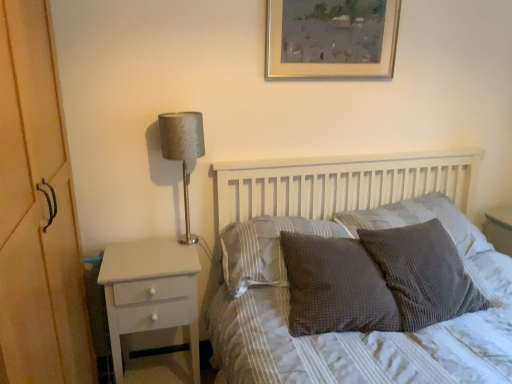
Locate an element on the screen. gold/golden frame at upper center is located at coordinates (331, 38).

At what (x,y) coordinates should I click in order to perform the action: click on textured gray pillow at center, marked as the 2th pillow in a left-to-right arrangement. Please return your answer as a coordinate pair (x, y). This screenshot has width=512, height=384. Looking at the image, I should click on (335, 287).

Measure the distance between satin silver lamp at left and camera.

5.82 feet.

The height and width of the screenshot is (384, 512). Find the location of `textured gray pillow at center, which is counted as the fourth pillow, starting from the left`. textured gray pillow at center, which is counted as the fourth pillow, starting from the left is located at coordinates (419, 221).

Describe the element at coordinates (150, 292) in the screenshot. I see `white painted wood nightstand at left` at that location.

This screenshot has width=512, height=384. In order to click on textured gray pillow at center, which is the 4th pillow in right-to-left order in this screenshot , I will do `click(264, 249)`.

Considering the positions of point (348, 284) and point (280, 2), is point (348, 284) closer or farther from the camera than point (280, 2)?

Point (348, 284) is closer to the camera than point (280, 2).

How different are the orientations of textured gray pillow at center, marked as the 2th pillow in a left-to-right arrangement, and gold/golden frame at upper center in degrees?

The angular difference between textured gray pillow at center, marked as the 2th pillow in a left-to-right arrangement, and gold/golden frame at upper center is 8.53 degrees.

In terms of height, does textured gray pillow at center, marked as the 2th pillow in a left-to-right arrangement, look taller or shorter compared to gold/golden frame at upper center?

Clearly, textured gray pillow at center, marked as the 2th pillow in a left-to-right arrangement, is shorter compared to gold/golden frame at upper center.

Image resolution: width=512 pixels, height=384 pixels. Find the location of `picture frame that is above the textured gray pillow at center, the 3th pillow viewed from the right (from the image's perspective)`. picture frame that is above the textured gray pillow at center, the 3th pillow viewed from the right (from the image's perspective) is located at coordinates (331, 38).

Which object is further away from the camera taking this photo, textured gray pillow at center, which is the 4th pillow in right-to-left order, or textured gray pillow at center, the first pillow positioned from the right?

Positioned behind is textured gray pillow at center, the first pillow positioned from the right.

Does textured gray pillow at center, which is counted as the 1th pillow, starting from the left, have a larger size compared to textured gray pillow at center, the first pillow positioned from the right?

No.

Is textured gray pillow at center, which is counted as the 1th pillow, starting from the left, facing away from textured gray pillow at center, which is counted as the fourth pillow, starting from the left?

No, textured gray pillow at center, which is counted as the 1th pillow, starting from the left, is not facing away from textured gray pillow at center, which is counted as the fourth pillow, starting from the left.

From a real-world perspective, who is located lower, textured gray pillow at center, which is the 4th pillow in right-to-left order, or textured gray pillow at center, the first pillow positioned from the right?

textured gray pillow at center, which is the 4th pillow in right-to-left order, is physically lower.

Which object is more forward, white painted wood nightstand at left or gold/golden frame at upper center?

white painted wood nightstand at left is in front.

Identify the location of nightstand below the gold/golden frame at upper center (from the image's perspective). The width and height of the screenshot is (512, 384). (150, 292).

How distant is white painted wood nightstand at left from gold/golden frame at upper center?

The distance of white painted wood nightstand at left from gold/golden frame at upper center is 1.15 meters.

Does white painted wood nightstand at left have a smaller size compared to gold/golden frame at upper center?

No, white painted wood nightstand at left is not smaller than gold/golden frame at upper center.

From the image's perspective, does white painted wood nightstand at left appear lower than satin silver lamp at left?

Indeed, from the image's perspective, white painted wood nightstand at left is shown beneath satin silver lamp at left.

Is white painted wood nightstand at left smaller than satin silver lamp at left?

No, white painted wood nightstand at left is not smaller than satin silver lamp at left.

How far apart are white painted wood nightstand at left and satin silver lamp at left?

white painted wood nightstand at left and satin silver lamp at left are 14.99 inches apart from each other.

Is white painted wood nightstand at left at the right side of satin silver lamp at left?

In fact, white painted wood nightstand at left is to the left of satin silver lamp at left.

Which is correct: textured gray pillow at center, which is counted as the 1th pillow, starting from the left, is inside satin silver lamp at left, or outside of it?

textured gray pillow at center, which is counted as the 1th pillow, starting from the left, is not enclosed by satin silver lamp at left.

Which of these two, textured gray pillow at center, which is counted as the 1th pillow, starting from the left, or satin silver lamp at left, is thinner?

satin silver lamp at left is thinner.

Is textured gray pillow at center, which is counted as the 1th pillow, starting from the left, facing away from satin silver lamp at left?

No, textured gray pillow at center, which is counted as the 1th pillow, starting from the left,'s orientation is not away from satin silver lamp at left.

From the image's perspective, between textured gray pillow at center, which is counted as the 1th pillow, starting from the left, and satin silver lamp at left, which one is located above?

satin silver lamp at left appears higher in the image.

Considering the positions of objects textured gray pillow at center, which is counted as the fourth pillow, starting from the left, and waffle-textured gray pillow at center-right, the 3th pillow when ordered from left to right, in the image provided, who is behind, textured gray pillow at center, which is counted as the fourth pillow, starting from the left, or waffle-textured gray pillow at center-right, the 3th pillow when ordered from left to right,?

textured gray pillow at center, which is counted as the fourth pillow, starting from the left.

From the image's perspective, between textured gray pillow at center, the first pillow positioned from the right, and waffle-textured gray pillow at center-right, acting as the second pillow starting from the right, who is located below?

From the image's view, waffle-textured gray pillow at center-right, acting as the second pillow starting from the right, is below.

From the picture: Between textured gray pillow at center, marked as the 2th pillow in a left-to-right arrangement, and waffle-textured gray pillow at center-right, the 3th pillow when ordered from left to right, which one appears on the right side from the viewer's perspective?

From the viewer's perspective, waffle-textured gray pillow at center-right, the 3th pillow when ordered from left to right, appears more on the right side.

How distant is textured gray pillow at center, marked as the 2th pillow in a left-to-right arrangement, from waffle-textured gray pillow at center-right, the 3th pillow when ordered from left to right?

The distance of textured gray pillow at center, marked as the 2th pillow in a left-to-right arrangement, from waffle-textured gray pillow at center-right, the 3th pillow when ordered from left to right, is 6.95 inches.

From the image's perspective, is textured gray pillow at center, the 3th pillow viewed from the right, over waffle-textured gray pillow at center-right, the 3th pillow when ordered from left to right?

No.

From a real-world perspective, between textured gray pillow at center, marked as the 2th pillow in a left-to-right arrangement, and waffle-textured gray pillow at center-right, the 3th pillow when ordered from left to right, who is vertically higher?

waffle-textured gray pillow at center-right, the 3th pillow when ordered from left to right, from a real-world perspective.

Where is `pillow that is the 4th object located below the gold/golden frame at upper center (from the image's perspective)`? Image resolution: width=512 pixels, height=384 pixels. pillow that is the 4th object located below the gold/golden frame at upper center (from the image's perspective) is located at coordinates (335, 287).

This screenshot has height=384, width=512. Find the location of `the 1st pillow in front of the textured gray pillow at center, the first pillow positioned from the right, starting your count from the anchor`. the 1st pillow in front of the textured gray pillow at center, the first pillow positioned from the right, starting your count from the anchor is located at coordinates (264, 249).

Considering their positions, is textured gray pillow at center, which is counted as the 1th pillow, starting from the left, positioned closer to textured gray pillow at center, the first pillow positioned from the right, than white painted wood nightstand at left?

The object closer to textured gray pillow at center, the first pillow positioned from the right, is textured gray pillow at center, which is counted as the 1th pillow, starting from the left.

From the image, which object appears to be nearer to waffle-textured gray pillow at center-right, the 3th pillow when ordered from left to right, gold/golden frame at upper center or textured gray pillow at center, marked as the 2th pillow in a left-to-right arrangement?

textured gray pillow at center, marked as the 2th pillow in a left-to-right arrangement, is positioned closer to the anchor waffle-textured gray pillow at center-right, the 3th pillow when ordered from left to right.

In the scene shown: Estimate the real-world distances between objects in this image. Which object is closer to textured gray pillow at center, which is counted as the 1th pillow, starting from the left, gold/golden frame at upper center or white painted wood nightstand at left?

Based on the image, white painted wood nightstand at left appears to be nearer to textured gray pillow at center, which is counted as the 1th pillow, starting from the left.

Considering their positions, is satin silver lamp at left positioned closer to white painted wood nightstand at left than textured gray pillow at center, the first pillow positioned from the right?

satin silver lamp at left is closer to white painted wood nightstand at left.

Estimate the real-world distances between objects in this image. Which object is further from textured gray pillow at center, which is the 4th pillow in right-to-left order, textured gray pillow at center, the 3th pillow viewed from the right, or satin silver lamp at left?

satin silver lamp at left lies further to textured gray pillow at center, which is the 4th pillow in right-to-left order, than the other object.

Considering their positions, is gold/golden frame at upper center positioned further to white painted wood nightstand at left than waffle-textured gray pillow at center-right, acting as the second pillow starting from the right?

gold/golden frame at upper center.

From the image, which object appears to be nearer to textured gray pillow at center, marked as the 2th pillow in a left-to-right arrangement, textured gray pillow at center, which is counted as the 1th pillow, starting from the left, or textured gray pillow at center, which is counted as the fourth pillow, starting from the left?

textured gray pillow at center, which is counted as the 1th pillow, starting from the left, is positioned closer to the anchor textured gray pillow at center, marked as the 2th pillow in a left-to-right arrangement.

From the image, which object appears to be farther from white painted wood nightstand at left, textured gray pillow at center, the first pillow positioned from the right, or textured gray pillow at center, which is the 4th pillow in right-to-left order?

textured gray pillow at center, the first pillow positioned from the right.

This screenshot has width=512, height=384. Identify the location of pillow between white painted wood nightstand at left and textured gray pillow at center, the 3th pillow viewed from the right, in the horizontal direction. (264, 249).

Identify the location of table lamp located between white painted wood nightstand at left and textured gray pillow at center, which is counted as the fourth pillow, starting from the left, in the left-right direction. (183, 152).

Image resolution: width=512 pixels, height=384 pixels. I want to click on pillow located between satin silver lamp at left and textured gray pillow at center, marked as the 2th pillow in a left-to-right arrangement, in the left-right direction, so click(264, 249).

Identify the location of table lamp between gold/golden frame at upper center and white painted wood nightstand at left in the up-down direction. The width and height of the screenshot is (512, 384). (183, 152).